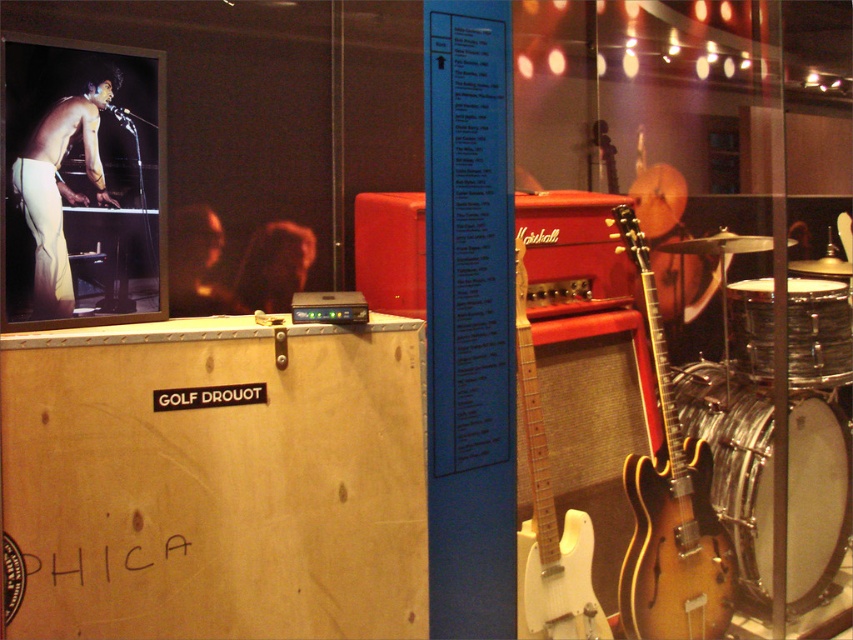
You are a museum visitor standing in front of the display area. You see the sunburst wood electric guitar at right. Can you determine its exact position in the scene?

The sunburst wood electric guitar at right is located at point (670, 508).

You are a museum curator setting up an exhibit. You have a sunburst wood electric guitar at right and a shiny silver drum at right. The display area has a 60 cm wide space between two shelves. Can you place both items side by side without overlapping?

The sunburst wood electric guitar at right is 60.18 centimeters from the shiny silver drum at right. Since the space between the shelves is only 60 cm, placing them side by side would require 60.18 cm, which exceeds the available space. Therefore, they cannot be placed side by side without overlapping.

You are a museum curator arranging a new exhibit. You need to place a tall stand for the sunburst wood electric guitar at right and a smaller stand for the shiny silver drum at right. Which object requires a taller stand?

The sunburst wood electric guitar at right requires a taller stand because it is much taller than the shiny silver drum at right.